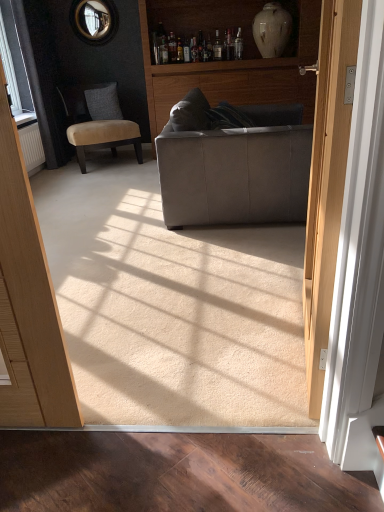
The height and width of the screenshot is (512, 384). Identify the location of suede gray couch at center. (233, 164).

This screenshot has height=512, width=384. Identify the location of velvet beige chair at left. (97, 120).

Identify the location of matte gray couch at center. (228, 61).

The width and height of the screenshot is (384, 512). What are the coordinates of `suede-like gray pillow at left` in the screenshot? It's located at (103, 102).

In terms of size, does suede-like gray pillow at left appear bigger or smaller than white glossy vase at upper center?

suede-like gray pillow at left is smaller than white glossy vase at upper center.

Consider the image. Is suede-like gray pillow at left positioned behind white glossy vase at upper center?

Yes, it is behind white glossy vase at upper center.

Which is more to the right, suede-like gray pillow at left or white glossy vase at upper center?

white glossy vase at upper center is more to the right.

Is suede-like gray pillow at left surrounding white glossy vase at upper center?

No, white glossy vase at upper center is not a part of suede-like gray pillow at left.

Between velvet beige chair at left and white glossy vase at upper center, which one has smaller width?

white glossy vase at upper center is thinner.

How different are the orientations of velvet beige chair at left and white glossy vase at upper center in degrees?

velvet beige chair at left and white glossy vase at upper center are facing 31.9 degrees away from each other.

In the image, is velvet beige chair at left on the left side or the right side of white glossy vase at upper center?

velvet beige chair at left is positioned on white glossy vase at upper center's left side.

Considering the positions of point (104, 120) and point (279, 41), is point (104, 120) closer or farther from the camera than point (279, 41)?

Point (104, 120) is farther from the camera than point (279, 41).

From a real-world perspective, which is physically below, white glossy vase at upper center or matte gray couch at center?

matte gray couch at center.

I want to click on bookshelf below the white glossy vase at upper center (from the image's perspective), so click(x=228, y=61).

Measure the distance between white glossy vase at upper center and matte gray couch at center.

17.05 inches.

Would you consider white glossy vase at upper center to be distant from matte gray couch at center?

No, there isn't a large distance between white glossy vase at upper center and matte gray couch at center.

Can you confirm if suede gray couch at center is wider than velvet beige chair at left?

Correct, the width of suede gray couch at center exceeds that of velvet beige chair at left.

This screenshot has width=384, height=512. In order to click on chair that appears on the left of suede gray couch at center in this screenshot , I will do `click(97, 120)`.

Is suede gray couch at center spatially inside velvet beige chair at left, or outside of it?

suede gray couch at center exists outside the volume of velvet beige chair at left.

Does matte gray couch at center have a greater height compared to suede gray couch at center?

Yes.

Considering the relative sizes of matte gray couch at center and suede gray couch at center in the image provided, is matte gray couch at center thinner than suede gray couch at center?

Yes.

Which is closer, (143, 56) or (267, 130)?

Positioned in front is point (267, 130).

From a real-world perspective, is matte gray couch at center located higher than suede gray couch at center?

Yes, from a real-world perspective, matte gray couch at center is over suede gray couch at center

Is suede-like gray pillow at left to the right of matte gray couch at center from the viewer's perspective?

In fact, suede-like gray pillow at left is to the left of matte gray couch at center.

Is matte gray couch at center located within suede-like gray pillow at left?

Actually, matte gray couch at center is outside suede-like gray pillow at left.

Is point (93, 111) farther from camera compared to point (255, 10)?

Yes.

Between velvet beige chair at left and suede-like gray pillow at left, which one has smaller size?

suede-like gray pillow at left.

Are velvet beige chair at left and suede-like gray pillow at left far apart?

No.

From a real-world perspective, who is located lower, velvet beige chair at left or suede-like gray pillow at left?

In real-world perspective, velvet beige chair at left is lower.

Identify the location of vase on the right of suede-like gray pillow at left. The width and height of the screenshot is (384, 512). (272, 30).

This screenshot has width=384, height=512. Find the location of `vase above the velvet beige chair at left (from a real-world perspective)`. vase above the velvet beige chair at left (from a real-world perspective) is located at coordinates (x=272, y=30).

From the image, which object appears to be nearer to white glossy vase at upper center, velvet beige chair at left or suede gray couch at center?

velvet beige chair at left.

When comparing their distances from suede gray couch at center, does velvet beige chair at left or suede-like gray pillow at left seem closer?

The object closer to suede gray couch at center is velvet beige chair at left.

When comparing their distances from velvet beige chair at left, does matte gray couch at center or white glossy vase at upper center seem closer?

matte gray couch at center is closer to velvet beige chair at left.

Looking at the image, which one is located closer to suede-like gray pillow at left, matte gray couch at center or suede gray couch at center?

Among the two, matte gray couch at center is located nearer to suede-like gray pillow at left.

Looking at the image, which one is located further to velvet beige chair at left, white glossy vase at upper center or matte gray couch at center?

white glossy vase at upper center is further to velvet beige chair at left.

Estimate the real-world distances between objects in this image. Which object is further from suede-like gray pillow at left, matte gray couch at center or velvet beige chair at left?

matte gray couch at center is positioned further to the anchor suede-like gray pillow at left.

Looking at the image, which one is located closer to white glossy vase at upper center, suede-like gray pillow at left or velvet beige chair at left?

The object closer to white glossy vase at upper center is velvet beige chair at left.

Which object lies further to the anchor point white glossy vase at upper center, matte gray couch at center or suede gray couch at center?

suede gray couch at center lies further to white glossy vase at upper center than the other object.

Image resolution: width=384 pixels, height=512 pixels. What are the coordinates of `chair positioned between suede gray couch at center and suede-like gray pillow at left from near to far` in the screenshot? It's located at (97, 120).

This screenshot has width=384, height=512. In order to click on chair located between suede gray couch at center and white glossy vase at upper center in the depth direction in this screenshot , I will do pos(97,120).

Locate an element on the screen. The width and height of the screenshot is (384, 512). pillow between velvet beige chair at left and white glossy vase at upper center from left to right is located at coordinates [x=103, y=102].

I want to click on bookshelf between suede gray couch at center and white glossy vase at upper center from front to back, so click(x=228, y=61).